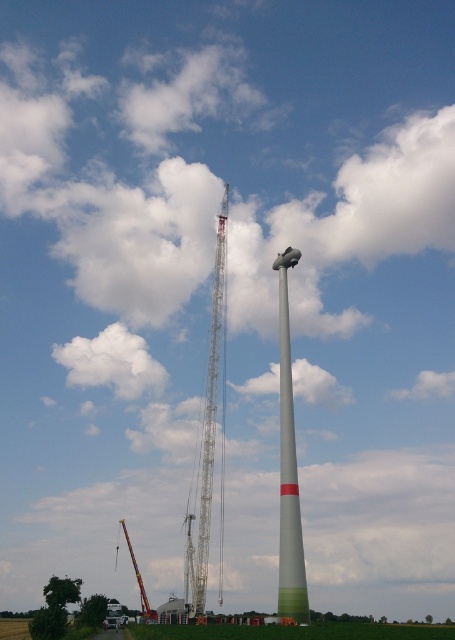
Question: Which of the following is the closest to the observer?

Choices:
 (A) (131, 552)
 (B) (200, 589)

Answer: (B)

Question: Which of the following is the closest to the observer?

Choices:
 (A) (296, 531)
 (B) (125, 531)
 (C) (208, 413)

Answer: (A)

Question: Does white matte wind turbine at center have a lesser width compared to metallic lattice tower at center?

Choices:
 (A) no
 (B) yes

Answer: (B)

Question: Where is white matte wind turbine at center located in relation to metallic lattice tower at center in the image?

Choices:
 (A) below
 (B) above

Answer: (A)

Question: Does white matte wind turbine at center appear over metallic lattice tower at center?

Choices:
 (A) yes
 (B) no

Answer: (B)

Question: Among these objects, which one is farthest from the camera?

Choices:
 (A) white matte wind turbine at center
 (B) metallic gray crane at center
 (C) metallic lattice tower at center

Answer: (B)